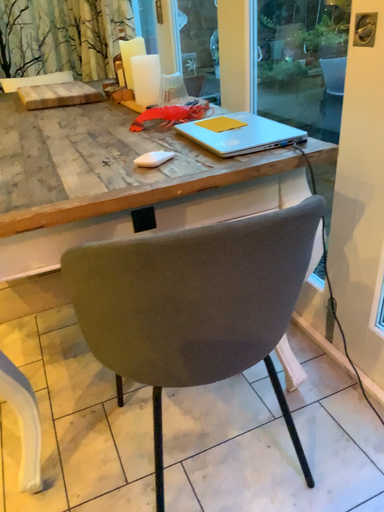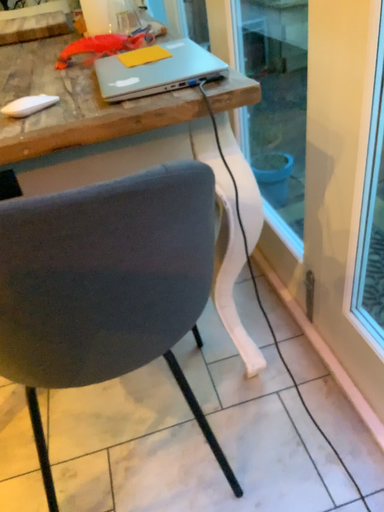
Question: Which way did the camera rotate in the video?

Choices:
 (A) rotated right
 (B) rotated left

Answer: (B)